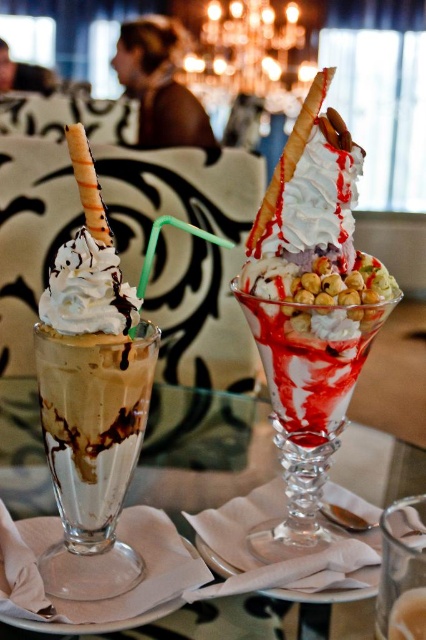
Question: Which of the following is the closest to the observer?

Choices:
 (A) (287, 234)
 (B) (258, 616)

Answer: (B)

Question: Which object appears closest to the camera in this image?

Choices:
 (A) white creamy ice cream sundae at center
 (B) transparent glass table at center

Answer: (B)

Question: Does white creamy ice cream sundae at center come in front of transparent glass table at center?

Choices:
 (A) yes
 (B) no

Answer: (B)

Question: Is white creamy ice cream sundae at center in front of transparent glass table at center?

Choices:
 (A) yes
 (B) no

Answer: (B)

Question: Does white creamy ice cream sundae at center lie in front of transparent glass table at center?

Choices:
 (A) yes
 (B) no

Answer: (B)

Question: Which point is farther to the camera?

Choices:
 (A) transparent glass table at center
 (B) white creamy ice cream sundae at center

Answer: (B)